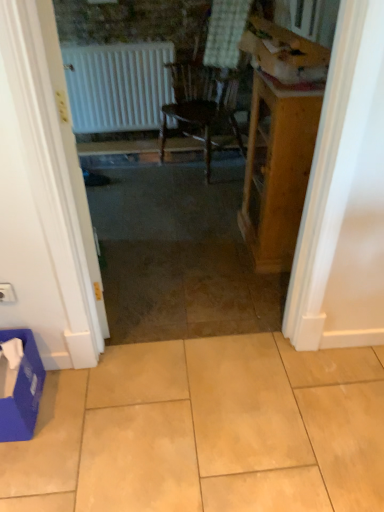
Question: Is white matte door at left facing towards beige ceramic tile at center?

Choices:
 (A) no
 (B) yes

Answer: (A)

Question: Can you confirm if white matte door at left is taller than beige ceramic tile at center?

Choices:
 (A) yes
 (B) no

Answer: (A)

Question: Is white matte door at left far away from beige ceramic tile at center?

Choices:
 (A) no
 (B) yes

Answer: (A)

Question: Is white matte door at left at the right side of beige ceramic tile at center?

Choices:
 (A) yes
 (B) no

Answer: (B)

Question: Does white matte door at left lie behind beige ceramic tile at center?

Choices:
 (A) yes
 (B) no

Answer: (B)

Question: From the image's perspective, does white matte door at left appear lower than beige ceramic tile at center?

Choices:
 (A) no
 (B) yes

Answer: (A)

Question: Does white plastic electric outlet at lower left lie behind cardboard box at upper right, positioned as the first cardboard box in top-to-bottom order?

Choices:
 (A) no
 (B) yes

Answer: (A)

Question: From a real-world perspective, is white plastic electric outlet at lower left under cardboard box at upper right, positioned as the first cardboard box in top-to-bottom order?

Choices:
 (A) no
 (B) yes

Answer: (B)

Question: Does white plastic electric outlet at lower left have a greater height compared to cardboard box at upper right, the first cardboard box in the right-to-left sequence?

Choices:
 (A) no
 (B) yes

Answer: (A)

Question: From the image's perspective, is white plastic electric outlet at lower left on top of cardboard box at upper right, the second cardboard box viewed from the left?

Choices:
 (A) yes
 (B) no

Answer: (B)

Question: Is white plastic electric outlet at lower left outside of cardboard box at upper right, the second cardboard box viewed from the left?

Choices:
 (A) yes
 (B) no

Answer: (A)

Question: Are white plastic electric outlet at lower left and cardboard box at upper right, the second cardboard box viewed from the left, far apart?

Choices:
 (A) yes
 (B) no

Answer: (A)

Question: Can you confirm if blue cardboard box at lower left, which appears as the 1th cardboard box when viewed from the left, is bigger than beige ceramic tile at center?

Choices:
 (A) yes
 (B) no

Answer: (B)